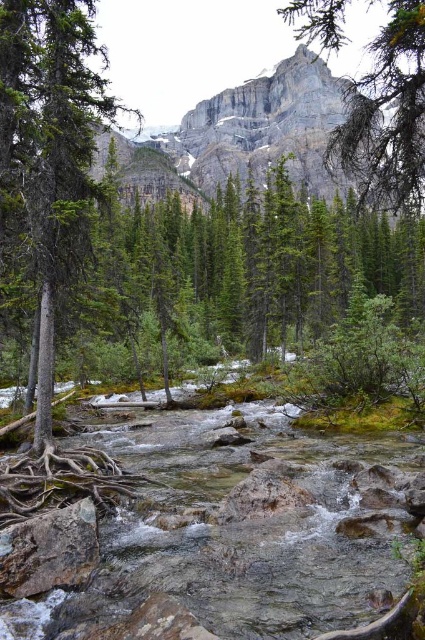
Consider the image. Which is below, green matte tree at left or gray rough rock at center?

Positioned lower is gray rough rock at center.

Between point (40, 294) and point (23, 572), which one is positioned behind?

Positioned behind is point (40, 294).

Is point (45, 144) positioned after point (6, 545)?

Yes, it is.

Where is `green matte tree at left`? This screenshot has height=640, width=425. green matte tree at left is located at coordinates (48, 163).

Is rocky cliff at upper center closer to camera compared to brown rough tree roots at lower left?

No, rocky cliff at upper center is behind brown rough tree roots at lower left.

Does rocky cliff at upper center have a greater height compared to brown rough tree roots at lower left?

Correct, rocky cliff at upper center is much taller as brown rough tree roots at lower left.

What are the coordinates of `rocky cliff at upper center` in the screenshot? It's located at (249, 132).

Which is in front, point (277, 108) or point (47, 554)?

Point (47, 554) is in front.

Is rocky cliff at upper center behind gray rough rock at center?

Yes, it is.

Is point (116, 141) farther from viewer compared to point (23, 548)?

That is True.

Identify the location of rocky cliff at upper center. This screenshot has height=640, width=425. click(249, 132).